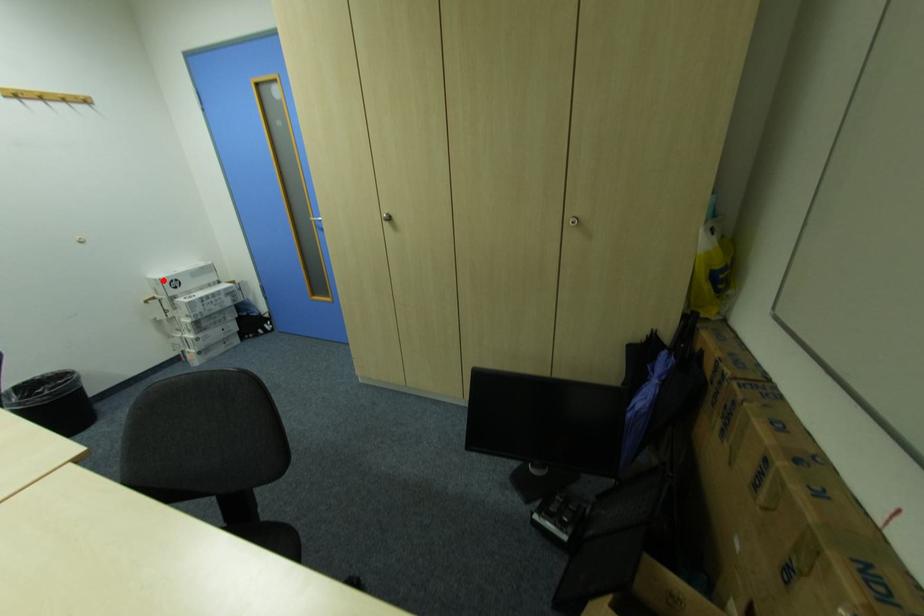
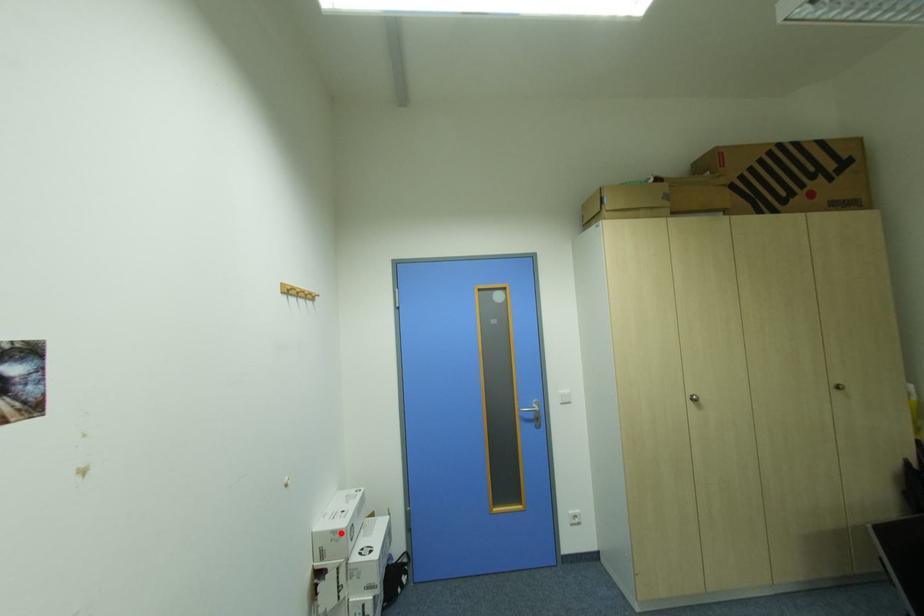
I am providing you with two images of the same scene from different viewpoints. A red point is marked on the first image and another point is marked on the second image. Does the point marked in image1 correspond to the same location as the one in image2?

Yes